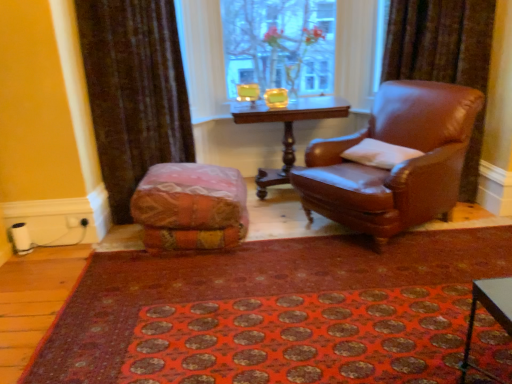
This screenshot has width=512, height=384. In order to click on textured multicolored bean bag at center in this screenshot , I will do `click(190, 207)`.

The width and height of the screenshot is (512, 384). What are the coordinates of `velvet brown curtain at left` in the screenshot? It's located at (134, 91).

What do you see at coordinates (276, 312) in the screenshot? Image resolution: width=512 pixels, height=384 pixels. I see `red carpet at center` at bounding box center [276, 312].

I want to click on transparent glass vase at upper center, so [203, 58].

This screenshot has width=512, height=384. What do you see at coordinates (203, 58) in the screenshot?
I see `transparent glass vase at upper center` at bounding box center [203, 58].

Identify the location of brown leather chair at right. This screenshot has height=384, width=512. (396, 166).

Does velvet brown curtain at left have a lesser height compared to textured multicolored bean bag at center?

Incorrect, the height of velvet brown curtain at left does not fall short of that of textured multicolored bean bag at center.

The width and height of the screenshot is (512, 384). Identify the location of curtain on the left side of textured multicolored bean bag at center. (134, 91).

Does velvet brown curtain at left have a lesser width compared to textured multicolored bean bag at center?

Correct, the width of velvet brown curtain at left is less than that of textured multicolored bean bag at center.

From the image's perspective, does velvet brown curtain at left appear lower than textured multicolored bean bag at center?

No.

From a real-world perspective, which is physically above, brown leather chair at right or transparent glass vase at upper center?

transparent glass vase at upper center.

Considering the positions of points (310, 190) and (216, 12), is point (310, 190) farther from camera compared to point (216, 12)?

No, it is not.

Image resolution: width=512 pixels, height=384 pixels. What are the coordinates of `chair that appears below the transparent glass vase at upper center (from the image's perspective)` in the screenshot? It's located at (396, 166).

From the image's perspective, is brown leather chair at right below transparent glass vase at upper center?

Correct, brown leather chair at right appears lower than transparent glass vase at upper center in the image.

Considering their positions, is textured multicolored bean bag at center located in front of or behind red carpet at center?

Clearly, textured multicolored bean bag at center is behind red carpet at center.

Would you say textured multicolored bean bag at center is to the left or to the right of red carpet at center in the picture?

In the image, textured multicolored bean bag at center appears on the left side of red carpet at center.

Which is farther from the camera, (x=212, y=168) or (x=291, y=321)?

The point (x=212, y=168) is farther.

Where is `bean bag chair located below the white soft pillow at right (from the image's perspective)`? The height and width of the screenshot is (384, 512). bean bag chair located below the white soft pillow at right (from the image's perspective) is located at coordinates (190, 207).

Which object is positioned more to the right, white soft pillow at right or textured multicolored bean bag at center?

white soft pillow at right.

Is white soft pillow at right situated inside textured multicolored bean bag at center or outside?

white soft pillow at right is not enclosed by textured multicolored bean bag at center.

Is wooden polished table at center spatially inside white soft pillow at right, or outside of it?

wooden polished table at center is not enclosed by white soft pillow at right.

Is wooden polished table at center directly adjacent to white soft pillow at right?

No, wooden polished table at center is not next to white soft pillow at right.

Looking at this image, considering the sizes of wooden polished table at center and white soft pillow at right in the image, is wooden polished table at center wider or thinner than white soft pillow at right?

Considering their sizes, wooden polished table at center looks broader than white soft pillow at right.

Is the position of wooden polished table at center less distant than that of white soft pillow at right?

No, it is behind white soft pillow at right.

Is white soft pillow at right facing away from wooden polished table at center?

No, white soft pillow at right's orientation is not away from wooden polished table at center.

Are white soft pillow at right and wooden polished table at center beside each other?

No, white soft pillow at right is not beside wooden polished table at center.

Is white soft pillow at right behind wooden polished table at center?

No, white soft pillow at right is closer to the camera.

Is white soft pillow at right in contact with transparent glass vase at upper center?

They are not placed beside each other.

Do you think white soft pillow at right is within transparent glass vase at upper center, or outside of it?

white soft pillow at right is not enclosed by transparent glass vase at upper center.

Which is in front, white soft pillow at right or transparent glass vase at upper center?

white soft pillow at right is closer to the camera.

Based on their positions, is white soft pillow at right located to the left or right of transparent glass vase at upper center?

white soft pillow at right is positioned on transparent glass vase at upper center's right side.

At what (x,y) coordinates should I click in order to perform the action: click on curtain that is above the textured multicolored bean bag at center (from the image's perspective). Please return your answer as a coordinate pair (x, y). The height and width of the screenshot is (384, 512). Looking at the image, I should click on (134, 91).

Locate an element on the screen. This screenshot has width=512, height=384. chair that appears on the right of transparent glass vase at upper center is located at coordinates (396, 166).

Considering their positions, is transparent glass vase at upper center positioned further to wooden polished table at center than white soft pillow at right?

Based on the image, white soft pillow at right appears to be further to wooden polished table at center.

Based on their spatial positions, is textured multicolored bean bag at center or brown leather chair at right closer to red carpet at center?

textured multicolored bean bag at center is closer to red carpet at center.

Looking at the image, which one is located further to textured multicolored bean bag at center, transparent glass vase at upper center or white soft pillow at right?

Based on the image, transparent glass vase at upper center appears to be further to textured multicolored bean bag at center.

Which object lies nearer to the anchor point white soft pillow at right, brown leather chair at right or transparent glass vase at upper center?

brown leather chair at right is positioned closer to the anchor white soft pillow at right.

Considering their positions, is brown leather chair at right positioned closer to wooden polished table at center than transparent glass vase at upper center?

transparent glass vase at upper center is positioned closer to the anchor wooden polished table at center.

Estimate the real-world distances between objects in this image. Which object is further from brown leather chair at right, textured multicolored bean bag at center or transparent glass vase at upper center?

Among the two, transparent glass vase at upper center is located further to brown leather chair at right.

When comparing their distances from wooden polished table at center, does transparent glass vase at upper center or brown leather chair at right seem further?

The object further to wooden polished table at center is brown leather chair at right.

From the picture: Looking at the image, which one is located further to white soft pillow at right, textured multicolored bean bag at center or red carpet at center?

Among the two, textured multicolored bean bag at center is located further to white soft pillow at right.

The image size is (512, 384). I want to click on pillow positioned between red carpet at center and wooden polished table at center from near to far, so click(x=379, y=154).

Find the location of a particular element. table located between textured multicolored bean bag at center and white soft pillow at right in the left-right direction is located at coordinates (287, 129).

At what (x,y) coordinates should I click in order to perform the action: click on pillow located between brown leather chair at right and transparent glass vase at upper center in the depth direction. Please return your answer as a coordinate pair (x, y). This screenshot has width=512, height=384. Looking at the image, I should click on (379, 154).

You are a GUI agent. You are given a task and a screenshot of the screen. Output one action in this format:
    pyautogui.click(x=<x>, y=<y>)
    Task: Click on the doormat located between velvet brown curtain at left and brown leather chair at right in the left-right direction
    The image size is (512, 384).
    Given the screenshot: What is the action you would take?
    pyautogui.click(x=276, y=312)